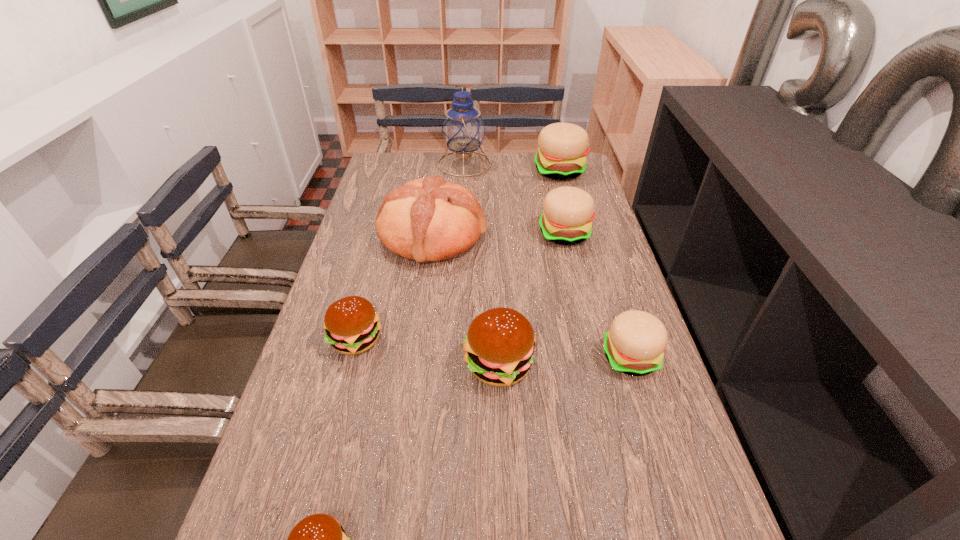
You are a GUI agent. You are given a task and a screenshot of the screen. Output one action in this format:
    pyautogui.click(x=<x>, y=<y>)
    Task: Click on the empty space between the farthest beige hamburger and the lantern
    
    Given the screenshot: What is the action you would take?
    click(x=512, y=167)

I want to click on blank region between the fifth nearest hamburger and the second smallest brown hamburger, so click(x=461, y=287).

Locate which object is the closest to the second nearest beige hamburger. Please provide its 2D coordinates. Your answer should be formatted as a tuple, i.e. [(x, y)], where the tuple contains the x and y coordinates of a point satisfying the conditions above.

[(427, 219)]

Identify the location of object that stands as the sixth closest to the second smallest brown hamburger. The height and width of the screenshot is (540, 960). point(463,129).

In order to click on hamburger that is the fifth closest to the rightmost brown hamburger in this screenshot , I will do `click(562, 147)`.

Image resolution: width=960 pixels, height=540 pixels. I want to click on hamburger that is the third closest one to the smallest brown hamburger, so click(634, 345).

Where is `the second closest beige hamburger to the farthest hamburger`? This screenshot has height=540, width=960. the second closest beige hamburger to the farthest hamburger is located at coordinates (634, 345).

Select which beige hamburger appears as the second closest to the farthest beige hamburger. Please provide its 2D coordinates. Your answer should be formatted as a tuple, i.e. [(x, y)], where the tuple contains the x and y coordinates of a point satisfying the conditions above.

[(634, 345)]

The width and height of the screenshot is (960, 540). In order to click on brown hamburger that stands as the second closest to the second smallest brown hamburger in this screenshot , I will do `click(319, 539)`.

I want to click on brown hamburger identified as the closest to the smallest brown hamburger, so click(x=500, y=342).